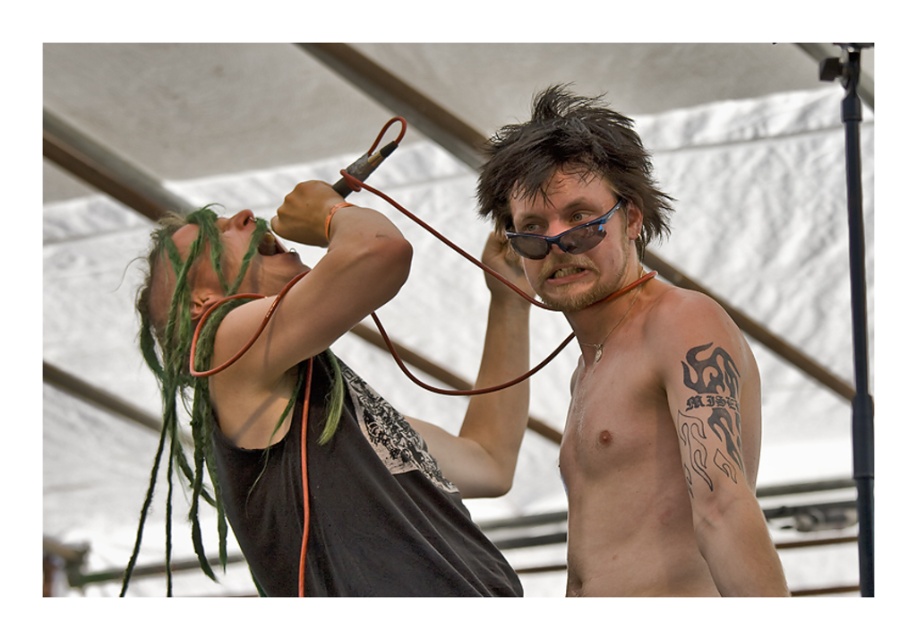
Based on the photo, between shiny black sunglasses at center and dark brown hair at upper center, which one has less height?

Standing shorter between the two is dark brown hair at upper center.

Is shiny black sunglasses at center above dark brown hair at upper center?

Incorrect, shiny black sunglasses at center is not positioned above dark brown hair at upper center.

Measure the distance between shiny black sunglasses at center and camera.

shiny black sunglasses at center is 7.63 feet from camera.

At what (x,y) coordinates should I click in order to perform the action: click on shiny black sunglasses at center. Please return your answer as a coordinate pair (x, y). This screenshot has width=917, height=640. Looking at the image, I should click on (633, 368).

Can you confirm if dark brown hair at upper center is bigger than blue plastic goggles at center?

Yes.

Which of these two, dark brown hair at upper center or blue plastic goggles at center, stands shorter?

blue plastic goggles at center is shorter.

Which is behind, point (615, 144) or point (542, 250)?

The point (542, 250) is behind.

Image resolution: width=917 pixels, height=640 pixels. What are the coordinates of `dark brown hair at upper center` in the screenshot? It's located at (570, 160).

Which of these two, black matte shirt at center or blue plastic goggles at center, stands shorter?

blue plastic goggles at center is shorter.

This screenshot has height=640, width=917. Find the location of `black matte shirt at center`. black matte shirt at center is located at coordinates (317, 410).